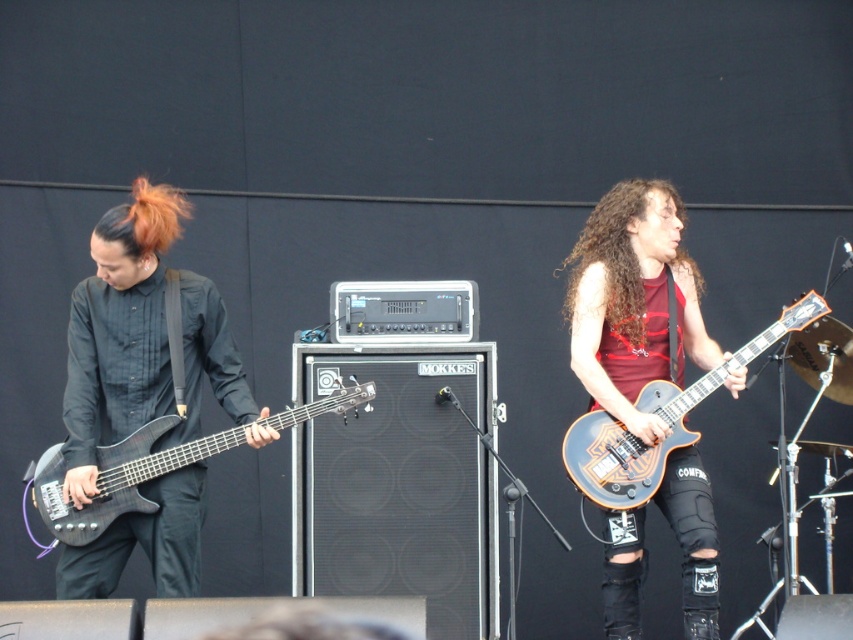
Question: Which point is closer to the camera taking this photo?

Choices:
 (A) [x=161, y=244]
 (B) [x=635, y=492]
 (C) [x=202, y=307]

Answer: (A)

Question: Observing the image, what is the correct spatial positioning of matte black electric guitar at right in reference to matte black bass at left?

Choices:
 (A) right
 (B) left

Answer: (A)

Question: Observing the image, what is the correct spatial positioning of matte black bass at left in reference to shiny orange hair at left?

Choices:
 (A) below
 (B) above

Answer: (A)

Question: Which point appears farthest from the camera in this image?

Choices:
 (A) (231, 368)
 (B) (569, 472)

Answer: (B)

Question: Does matte black bass guitar at left appear on the right side of shiny orange guitar at center?

Choices:
 (A) no
 (B) yes

Answer: (A)

Question: Which point is farther to the camera?

Choices:
 (A) shiny orange hair at left
 (B) shiny orange guitar at center
 (C) matte black electric guitar at right
 (D) matte black bass at left

Answer: (C)